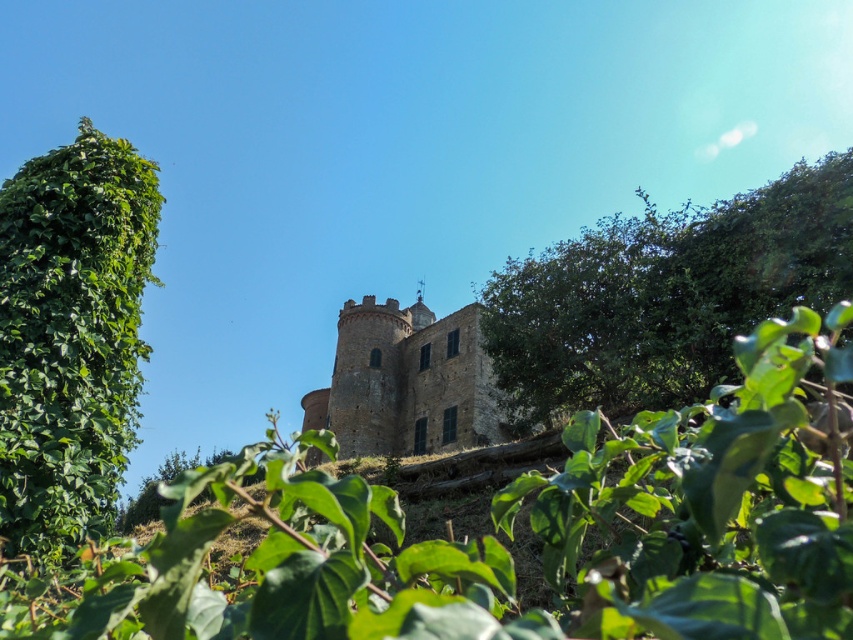
Question: Which object is closer to the camera taking this photo?

Choices:
 (A) brown stone castle at center
 (B) green leafy tree at left
 (C) green leafy tree at upper right

Answer: (B)

Question: Does green leafy tree at upper right have a smaller size compared to green leafy tree at left?

Choices:
 (A) yes
 (B) no

Answer: (B)

Question: Which point appears farthest from the camera in this image?

Choices:
 (A) (529, 358)
 (B) (413, 326)
 (C) (91, 356)

Answer: (B)

Question: Which of the following is the closest to the observer?

Choices:
 (A) brown stone castle at center
 (B) green leafy tree at left
 (C) green leafy tree at upper right

Answer: (B)

Question: Is green leafy tree at upper right wider than green leafy tree at left?

Choices:
 (A) yes
 (B) no

Answer: (A)

Question: Is green leafy tree at upper right thinner than brown stone castle at center?

Choices:
 (A) yes
 (B) no

Answer: (A)